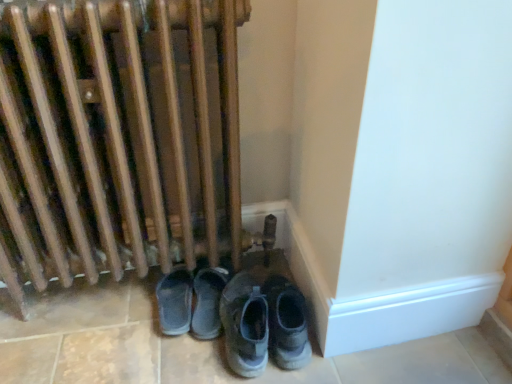
Question: Is gray suede sneakers at lower center, which ranks as the second footwear in right-to-left order, facing towards wooden radiator at lower left?

Choices:
 (A) no
 (B) yes

Answer: (A)

Question: Does gray suede sneakers at lower center, the 2th footwear positioned from the left, come behind wooden radiator at lower left?

Choices:
 (A) no
 (B) yes

Answer: (B)

Question: From a real-world perspective, is gray suede sneakers at lower center, the 2th footwear positioned from the left, physically above wooden radiator at lower left?

Choices:
 (A) yes
 (B) no

Answer: (B)

Question: Are gray suede sneakers at lower center, which ranks as the second footwear in right-to-left order, and wooden radiator at lower left making contact?

Choices:
 (A) no
 (B) yes

Answer: (A)

Question: Is wooden radiator at lower left at the back of gray suede sneakers at lower center, which ranks as the second footwear in right-to-left order?

Choices:
 (A) no
 (B) yes

Answer: (B)

Question: Is gray suede sneakers at lower center, which ranks as the second footwear in right-to-left order, positioned far away from wooden radiator at lower left?

Choices:
 (A) yes
 (B) no

Answer: (B)

Question: Does gray suede sneakers at lower center, the 2th footwear positioned from the left, have a greater height compared to gray suede shoes at lower center, marked as the first footwear in a left-to-right arrangement?

Choices:
 (A) no
 (B) yes

Answer: (B)

Question: Is gray suede sneakers at lower center, the 2th footwear positioned from the left, wider than gray suede shoes at lower center, positioned as the third footwear in right-to-left order?

Choices:
 (A) no
 (B) yes

Answer: (B)

Question: Does gray suede sneakers at lower center, the 2th footwear positioned from the left, turn towards gray suede shoes at lower center, positioned as the third footwear in right-to-left order?

Choices:
 (A) yes
 (B) no

Answer: (B)

Question: Is gray suede shoes at lower center, positioned as the third footwear in right-to-left order, located within gray suede sneakers at lower center, which ranks as the second footwear in right-to-left order?

Choices:
 (A) no
 (B) yes

Answer: (A)

Question: From a real-world perspective, is gray suede sneakers at lower center, which ranks as the second footwear in right-to-left order, beneath gray suede shoes at lower center, positioned as the third footwear in right-to-left order?

Choices:
 (A) no
 (B) yes

Answer: (A)

Question: Does gray suede sneakers at lower center, the 2th footwear positioned from the left, have a larger size compared to gray suede shoes at lower center, marked as the first footwear in a left-to-right arrangement?

Choices:
 (A) yes
 (B) no

Answer: (A)

Question: Is gray fabric sneakers at lower center, which ranks as the 1th footwear in right-to-left order, far from gray suede sneakers at lower center, the 2th footwear positioned from the left?

Choices:
 (A) no
 (B) yes

Answer: (A)